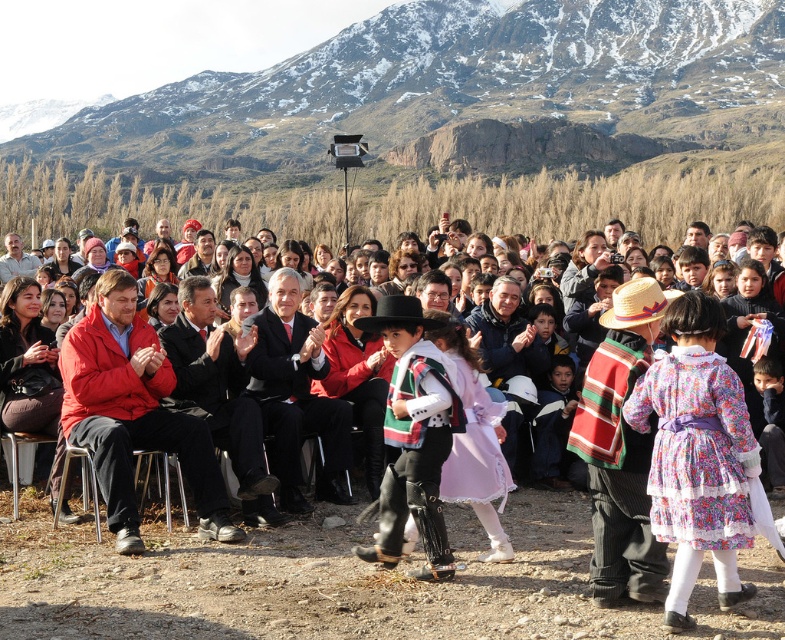
You are a photographer trying to capture the two points in the image. Which point, point (694, 522) or point (415, 428), will appear larger in your photo?

Point (694, 522) will appear larger in the photo because it is closer to the camera than point (415, 428).